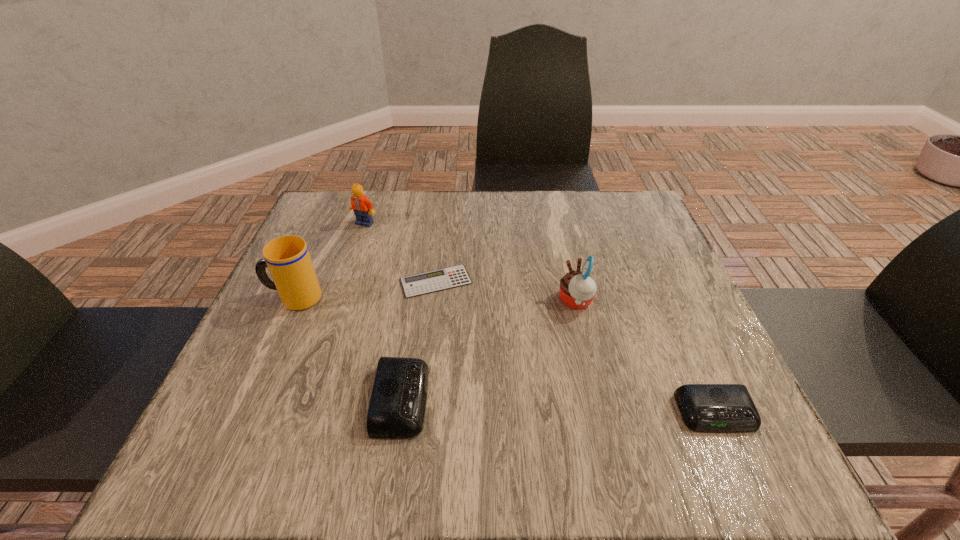
If equal spacing is desired by inserting an extra alarm_clock among them, please point out a free spot for this new alarm_clock. Please provide its 2D coordinates. Your answer should be formatted as a tuple, i.e. [(x, y)], where the tuple contains the x and y coordinates of a point satisfying the conditions above.

[(557, 406)]